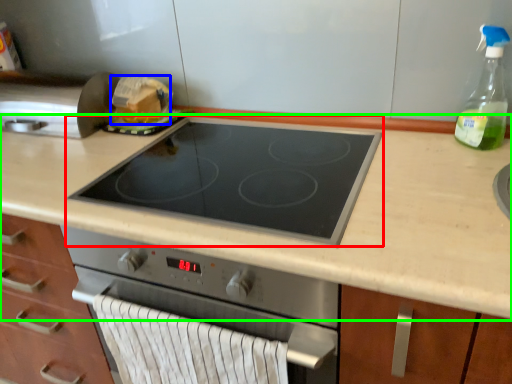
Question: Considering the real-world distances, which object is farthest from gas stove (highlighted by a red box)? food (highlighted by a blue box) or countertop (highlighted by a green box)?

Choices:
 (A) food
 (B) countertop

Answer: (A)